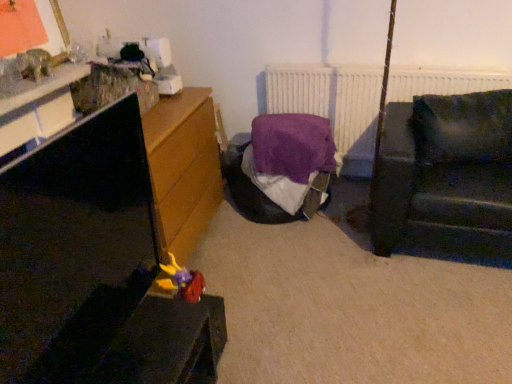
Question: Can you confirm if matt black tv stand at left is shorter than white matte radiator at upper center?

Choices:
 (A) no
 (B) yes

Answer: (A)

Question: Considering the relative positions of matt black tv stand at left and white matte radiator at upper center in the image provided, is matt black tv stand at left to the right of white matte radiator at upper center from the viewer's perspective?

Choices:
 (A) yes
 (B) no

Answer: (B)

Question: Is matt black tv stand at left taller than white matte radiator at upper center?

Choices:
 (A) yes
 (B) no

Answer: (A)

Question: Is matt black tv stand at left far from white matte radiator at upper center?

Choices:
 (A) no
 (B) yes

Answer: (B)

Question: Is matt black tv stand at left to the left of white matte radiator at upper center from the viewer's perspective?

Choices:
 (A) no
 (B) yes

Answer: (B)

Question: Considering the relative positions of matt black tv stand at left and plush yellow and purple toy at lower left in the image provided, is matt black tv stand at left to the left or to the right of plush yellow and purple toy at lower left?

Choices:
 (A) left
 (B) right

Answer: (A)

Question: Which is correct: matt black tv stand at left is inside plush yellow and purple toy at lower left, or outside of it?

Choices:
 (A) inside
 (B) outside

Answer: (B)

Question: Considering the positions of matt black tv stand at left and plush yellow and purple toy at lower left in the image, is matt black tv stand at left wider or thinner than plush yellow and purple toy at lower left?

Choices:
 (A) thin
 (B) wide

Answer: (A)

Question: In terms of height, does matt black tv stand at left look taller or shorter compared to plush yellow and purple toy at lower left?

Choices:
 (A) tall
 (B) short

Answer: (A)

Question: Looking at the image, does purple fabric bed at center seem bigger or smaller compared to plush yellow and purple toy at lower left?

Choices:
 (A) big
 (B) small

Answer: (A)

Question: From the image's perspective, is purple fabric bed at center located above or below plush yellow and purple toy at lower left?

Choices:
 (A) above
 (B) below

Answer: (A)

Question: Considering the positions of purple fabric bed at center and plush yellow and purple toy at lower left in the image, is purple fabric bed at center wider or thinner than plush yellow and purple toy at lower left?

Choices:
 (A) thin
 (B) wide

Answer: (B)

Question: Is purple fabric bed at center taller or shorter than plush yellow and purple toy at lower left?

Choices:
 (A) tall
 (B) short

Answer: (A)

Question: From the image's perspective, is matt black tv stand at left positioned above or below purple fabric bed at center?

Choices:
 (A) below
 (B) above

Answer: (A)

Question: In terms of size, does matt black tv stand at left appear bigger or smaller than purple fabric bed at center?

Choices:
 (A) big
 (B) small

Answer: (B)